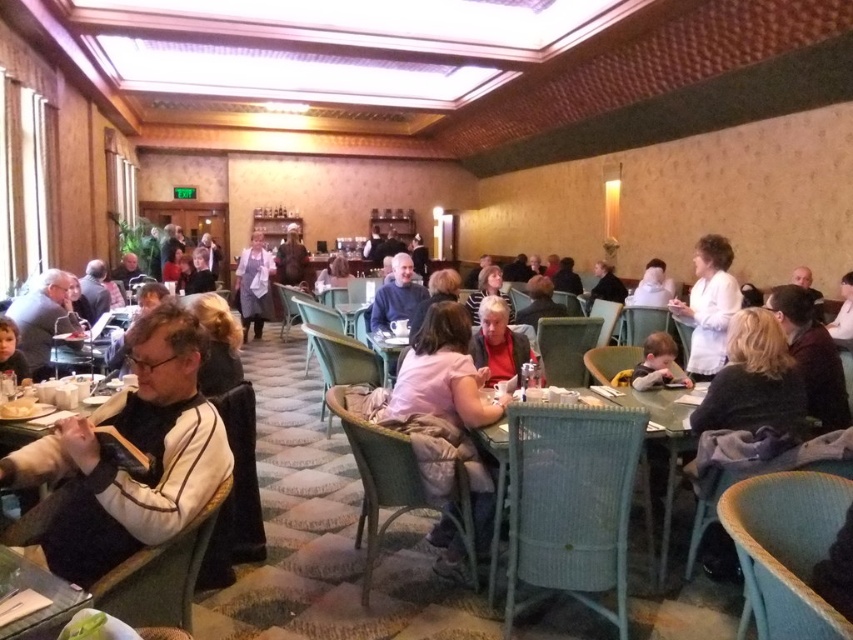
Does black fabric jacket at left have a lesser width compared to white apron at center?

Indeed, black fabric jacket at left has a lesser width compared to white apron at center.

Between black fabric jacket at left and white apron at center, which one has less height?

Standing shorter between the two is black fabric jacket at left.

Measure the distance between black fabric jacket at left and camera.

A distance of 5.13 feet exists between black fabric jacket at left and camera.

I want to click on black fabric jacket at left, so click(x=137, y=449).

Who is positioned more to the left, black fabric jacket at left or teal wicker table at center?

From the viewer's perspective, black fabric jacket at left appears more on the left side.

Is black fabric jacket at left below teal wicker table at center?

No.

Where is `black fabric jacket at left`? black fabric jacket at left is located at coordinates (137, 449).

Does black fabric jacket at left have a lesser height compared to white matte coat at upper right?

Yes.

Looking at this image, can you confirm if black fabric jacket at left is positioned to the right of white matte coat at upper right?

No, black fabric jacket at left is not to the right of white matte coat at upper right.

Measure the distance between black fabric jacket at left and camera.

The distance of black fabric jacket at left from camera is 5.13 feet.

The image size is (853, 640). In order to click on black fabric jacket at left in this screenshot , I will do `click(137, 449)`.